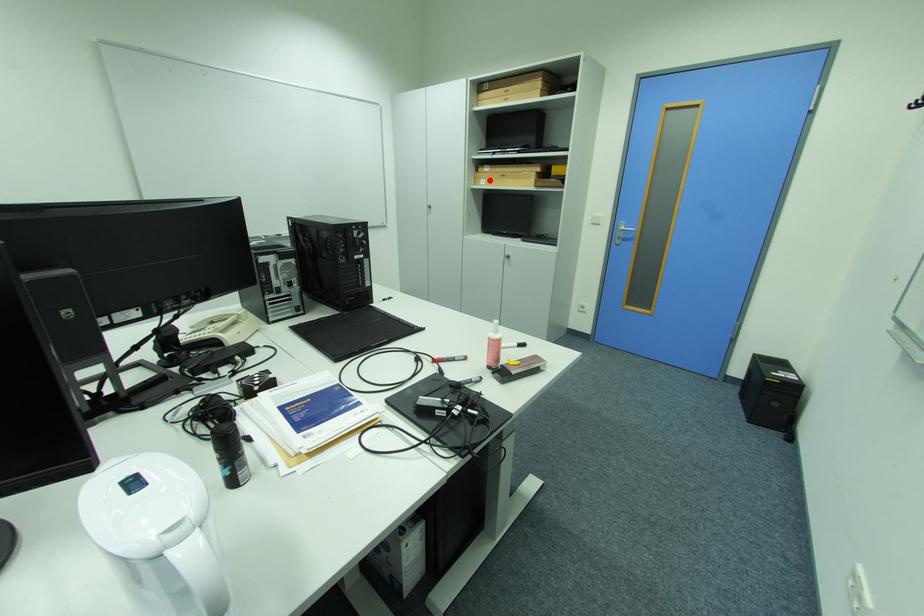
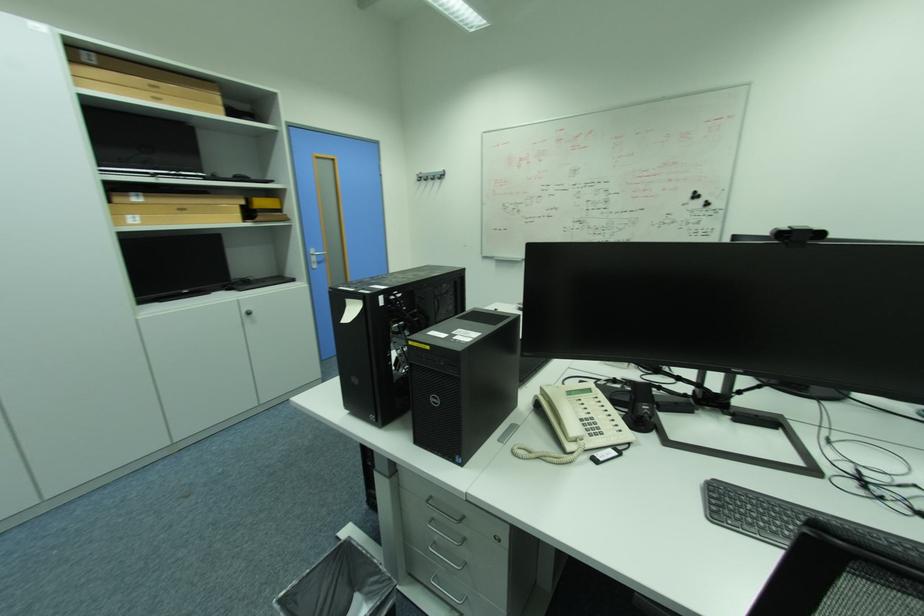
Locate, in the second image, the point that corresponds to the highlighted location in the first image.

(136, 217)